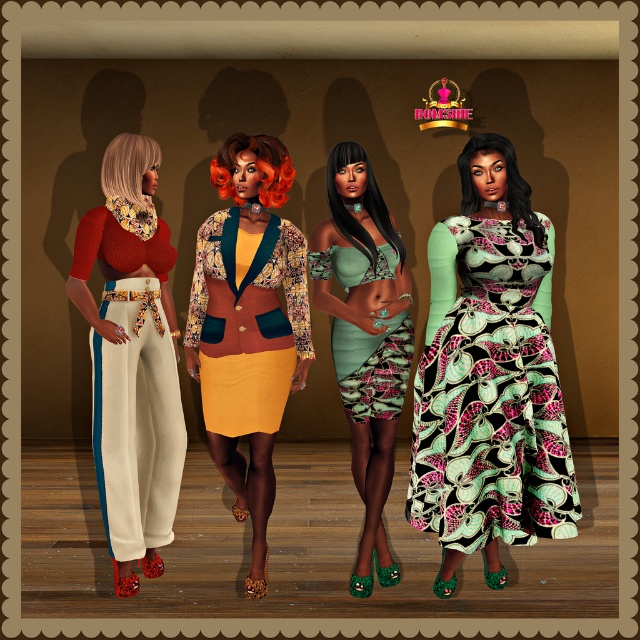
Question: Which point is closer to the camera?

Choices:
 (A) (490, 358)
 (B) (390, 364)

Answer: (A)

Question: Does matte floral pants at left appear on the left side of textured velvet blazer at center?

Choices:
 (A) no
 (B) yes

Answer: (B)

Question: Among these points, which one is farthest from the camera?

Choices:
 (A) (81, 240)
 (B) (401, 403)
 (C) (257, 579)

Answer: (C)

Question: Does matte floral pants at left have a smaller size compared to metallic gold crown at upper center?

Choices:
 (A) yes
 (B) no

Answer: (B)

Question: Which point appears farthest from the camera in this image?

Choices:
 (A) pyautogui.click(x=432, y=97)
 (B) pyautogui.click(x=385, y=244)

Answer: (A)

Question: Where is matte floral pants at left located in relation to mint green satin dress at center in the image?

Choices:
 (A) left
 (B) right

Answer: (A)